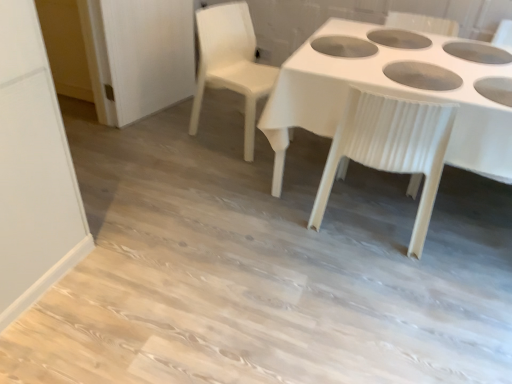
Locate an element on the screen. This screenshot has height=384, width=512. vacant space in front of white plastic table at center is located at coordinates (357, 306).